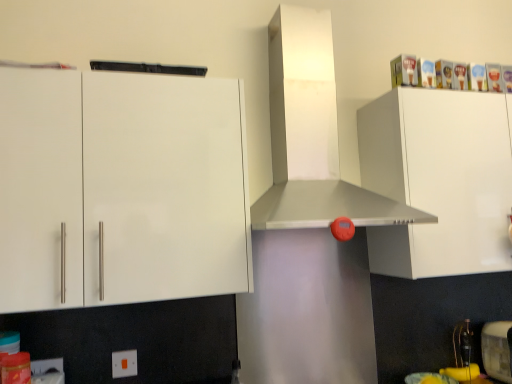
Measure the distance between point [47,376] and camera.

Point [47,376] and camera are 1.42 meters apart.

Find the location of a particular element. white plastic electric outlet at lower center, the first electric outlet in the right-to-left sequence is located at coordinates (124, 364).

What do you see at coordinates (496, 350) in the screenshot?
I see `metallic silver toaster at lower right` at bounding box center [496, 350].

In order to click on white glossy cabinet at upper left, which ranks as the 2th cabinetry in right-to-left order in this screenshot , I will do `click(121, 188)`.

The image size is (512, 384). I want to click on white plastic electric outlet at lower left, positioned as the second electric outlet in back-to-front order, so click(47, 371).

Which of these two, white glossy cabinet at upper left, positioned as the 1th cabinetry in left-to-right order, or white glossy cabinet at upper right, which is counted as the first cabinetry, starting from the right, stands shorter?

white glossy cabinet at upper right, which is counted as the first cabinetry, starting from the right, is shorter.

Can you confirm if white glossy cabinet at upper left, positioned as the 1th cabinetry in left-to-right order, is bigger than white glossy cabinet at upper right, which ranks as the 2th cabinetry in left-to-right order?

No, white glossy cabinet at upper left, positioned as the 1th cabinetry in left-to-right order, is not bigger than white glossy cabinet at upper right, which ranks as the 2th cabinetry in left-to-right order.

Is white glossy cabinet at upper right, which is counted as the first cabinetry, starting from the right, a part of white glossy cabinet at upper left, positioned as the 1th cabinetry in left-to-right order?

No, white glossy cabinet at upper left, positioned as the 1th cabinetry in left-to-right order, does not contain white glossy cabinet at upper right, which is counted as the first cabinetry, starting from the right.

Can metallic silver range hood at center be found inside metallic silver toaster at lower right?

That's incorrect, metallic silver range hood at center is not inside metallic silver toaster at lower right.

Between metallic silver toaster at lower right and metallic silver range hood at center, which one has larger width?

metallic silver range hood at center.

From the image's perspective, which one is positioned lower, metallic silver toaster at lower right or metallic silver range hood at center?

metallic silver toaster at lower right, from the image's perspective.

Which is closer, (x=108, y=119) or (x=377, y=195)?

Clearly, point (x=108, y=119) is closer to the camera than point (x=377, y=195).

Considering their positions, is white glossy cabinet at upper left, positioned as the 1th cabinetry in left-to-right order, located in front of or behind metallic silver range hood at center?

In the image, white glossy cabinet at upper left, positioned as the 1th cabinetry in left-to-right order, appears in front of metallic silver range hood at center.

Does white glossy cabinet at upper left, positioned as the 1th cabinetry in left-to-right order, touch metallic silver range hood at center?

white glossy cabinet at upper left, positioned as the 1th cabinetry in left-to-right order, and metallic silver range hood at center are clearly separated.

Is white glossy cabinet at upper left, which ranks as the 2th cabinetry in right-to-left order, positioned beyond the bounds of metallic silver range hood at center?

Yes, white glossy cabinet at upper left, which ranks as the 2th cabinetry in right-to-left order, is located beyond the bounds of metallic silver range hood at center.

Considering the relative positions of metallic silver toaster at lower right and white glossy cabinet at upper left, positioned as the 1th cabinetry in left-to-right order, in the image provided, is metallic silver toaster at lower right to the right of white glossy cabinet at upper left, positioned as the 1th cabinetry in left-to-right order, from the viewer's perspective?

Yes.

Is metallic silver toaster at lower right facing towards white glossy cabinet at upper left, which ranks as the 2th cabinetry in right-to-left order?

No, metallic silver toaster at lower right is not facing towards white glossy cabinet at upper left, which ranks as the 2th cabinetry in right-to-left order.

Looking at their sizes, would you say metallic silver toaster at lower right is wider or thinner than white glossy cabinet at upper left, positioned as the 1th cabinetry in left-to-right order?

Considering their sizes, metallic silver toaster at lower right looks slimmer than white glossy cabinet at upper left, positioned as the 1th cabinetry in left-to-right order.

Considering the relative positions of white plastic electric outlet at lower center, which is the 1th electric outlet in back-to-front order, and metallic silver toaster at lower right in the image provided, is white plastic electric outlet at lower center, which is the 1th electric outlet in back-to-front order, behind metallic silver toaster at lower right?

No, the depth of white plastic electric outlet at lower center, which is the 1th electric outlet in back-to-front order, is less than that of metallic silver toaster at lower right.

I want to click on appliance below the white plastic electric outlet at lower center, which appears as the second electric outlet when viewed from the front (from the image's perspective), so click(496, 350).

Is white plastic electric outlet at lower center, acting as the second electric outlet starting from the left, to the left or to the right of metallic silver toaster at lower right in the image?

From the image, it's evident that white plastic electric outlet at lower center, acting as the second electric outlet starting from the left, is to the left of metallic silver toaster at lower right.

Does metallic silver range hood at center have a smaller size compared to white plastic electric outlet at lower center, which appears as the second electric outlet when viewed from the front?

No.

This screenshot has height=384, width=512. What are the coordinates of `home appliance above the white plastic electric outlet at lower center, acting as the second electric outlet starting from the left (from a real-world perspective)` in the screenshot? It's located at (312, 135).

Considering the points (360, 201) and (116, 369), which point is behind, point (360, 201) or point (116, 369)?

The point (116, 369) is farther from the camera.

What's the angular difference between metallic silver range hood at center and white plastic electric outlet at lower center, acting as the second electric outlet starting from the left,'s facing directions?

1.37 degrees separate the facing orientations of metallic silver range hood at center and white plastic electric outlet at lower center, acting as the second electric outlet starting from the left.

From the picture: Considering the relative sizes of white plastic electric outlet at lower left, which ranks as the second electric outlet in right-to-left order, and white glossy cabinet at upper left, which ranks as the 2th cabinetry in right-to-left order, in the image provided, is white plastic electric outlet at lower left, which ranks as the second electric outlet in right-to-left order, bigger than white glossy cabinet at upper left, which ranks as the 2th cabinetry in right-to-left order,?

Incorrect, white plastic electric outlet at lower left, which ranks as the second electric outlet in right-to-left order, is not larger than white glossy cabinet at upper left, which ranks as the 2th cabinetry in right-to-left order.

Considering the relative sizes of white plastic electric outlet at lower left, the first electric outlet positioned from the left, and white glossy cabinet at upper left, positioned as the 1th cabinetry in left-to-right order, in the image provided, is white plastic electric outlet at lower left, the first electric outlet positioned from the left, wider than white glossy cabinet at upper left, positioned as the 1th cabinetry in left-to-right order,?

No, white plastic electric outlet at lower left, the first electric outlet positioned from the left, is not wider than white glossy cabinet at upper left, positioned as the 1th cabinetry in left-to-right order.

Is white plastic electric outlet at lower left, which ranks as the second electric outlet in right-to-left order, far away from white glossy cabinet at upper left, positioned as the 1th cabinetry in left-to-right order?

No.

From the image's perspective, which electric outlet is the 2nd one below the white glossy cabinet at upper left, positioned as the 1th cabinetry in left-to-right order? Please provide its 2D coordinates.

[(47, 371)]

Where is `cabinetry above the white glossy cabinet at upper left, positioned as the 1th cabinetry in left-to-right order (from the image's perspective)`? The image size is (512, 384). cabinetry above the white glossy cabinet at upper left, positioned as the 1th cabinetry in left-to-right order (from the image's perspective) is located at coordinates (439, 179).

This screenshot has height=384, width=512. Identify the location of appliance on the right of the metallic silver range hood at center. (496, 350).

Which object lies further to the anchor point white plastic electric outlet at lower center, acting as the second electric outlet starting from the left, white glossy cabinet at upper left, which ranks as the 2th cabinetry in right-to-left order, or metallic silver range hood at center?

metallic silver range hood at center.

Estimate the real-world distances between objects in this image. Which object is closer to white plastic electric outlet at lower left, which ranks as the second electric outlet in right-to-left order, metallic silver toaster at lower right or metallic silver range hood at center?

The object closer to white plastic electric outlet at lower left, which ranks as the second electric outlet in right-to-left order, is metallic silver range hood at center.

When comparing their distances from metallic silver toaster at lower right, does white plastic electric outlet at lower center, the first electric outlet in the right-to-left sequence, or metallic silver range hood at center seem closer?

Among the two, metallic silver range hood at center is located nearer to metallic silver toaster at lower right.

Based on their spatial positions, is white glossy cabinet at upper right, which is counted as the first cabinetry, starting from the right, or metallic silver range hood at center further from metallic silver toaster at lower right?

Based on the image, metallic silver range hood at center appears to be further to metallic silver toaster at lower right.

Which object lies further to the anchor point metallic silver toaster at lower right, white plastic electric outlet at lower left, which ranks as the second electric outlet in right-to-left order, or white glossy cabinet at upper right, which is counted as the first cabinetry, starting from the right?

white plastic electric outlet at lower left, which ranks as the second electric outlet in right-to-left order, is further to metallic silver toaster at lower right.

Considering their positions, is white glossy cabinet at upper right, which ranks as the 2th cabinetry in left-to-right order, positioned further to metallic silver toaster at lower right than white plastic electric outlet at lower center, which appears as the second electric outlet when viewed from the front?

A: Based on the image, white plastic electric outlet at lower center, which appears as the second electric outlet when viewed from the front, appears to be further to metallic silver toaster at lower right.

Looking at the image, which one is located further to metallic silver toaster at lower right, white plastic electric outlet at lower center, which is the 1th electric outlet in back-to-front order, or white glossy cabinet at upper right, which ranks as the 2th cabinetry in left-to-right order?

The object further to metallic silver toaster at lower right is white plastic electric outlet at lower center, which is the 1th electric outlet in back-to-front order.

From the image, which object appears to be nearer to metallic silver toaster at lower right, metallic silver range hood at center or white glossy cabinet at upper right, which ranks as the 2th cabinetry in left-to-right order?

The object closer to metallic silver toaster at lower right is white glossy cabinet at upper right, which ranks as the 2th cabinetry in left-to-right order.

What are the coordinates of `electric outlet located between white plastic electric outlet at lower left, the first electric outlet positioned from the left, and white glossy cabinet at upper right, which is counted as the first cabinetry, starting from the right, in the left-right direction` in the screenshot? It's located at (124, 364).

Identify the location of home appliance situated between white glossy cabinet at upper left, which ranks as the 2th cabinetry in right-to-left order, and metallic silver toaster at lower right from left to right. (312, 135).

Identify the location of cabinetry located between white plastic electric outlet at lower left, positioned as the second electric outlet in back-to-front order, and metallic silver range hood at center in the left-right direction. The image size is (512, 384). (121, 188).

The width and height of the screenshot is (512, 384). What are the coordinates of `home appliance situated between white plastic electric outlet at lower center, which appears as the second electric outlet when viewed from the front, and white glossy cabinet at upper right, which is counted as the first cabinetry, starting from the right, from left to right` in the screenshot? It's located at (312, 135).